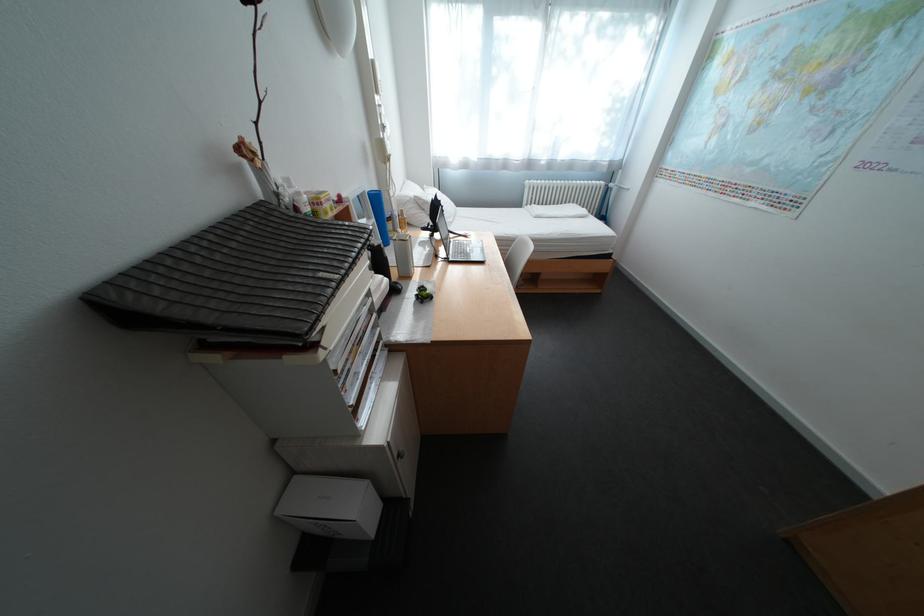
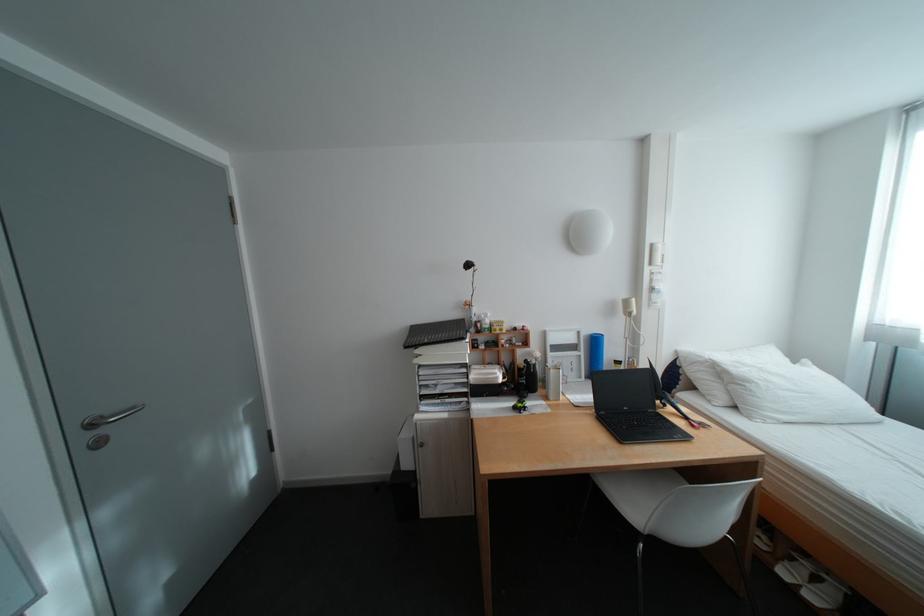
Where in the second image is the point corresponding to [385,63] from the first image?

(664, 246)